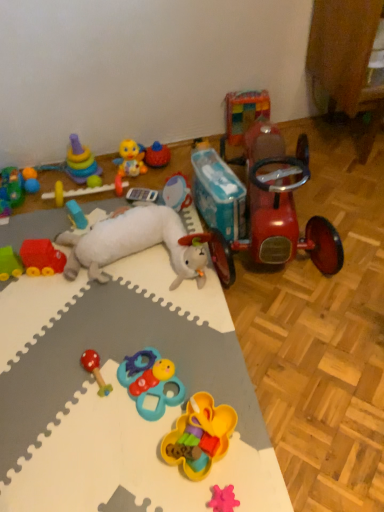
Find the location of `free space that is to the left of matte blue car at center-left, arranged as the 3th toy when viewed from the left`. free space that is to the left of matte blue car at center-left, arranged as the 3th toy when viewed from the left is located at coordinates (44, 222).